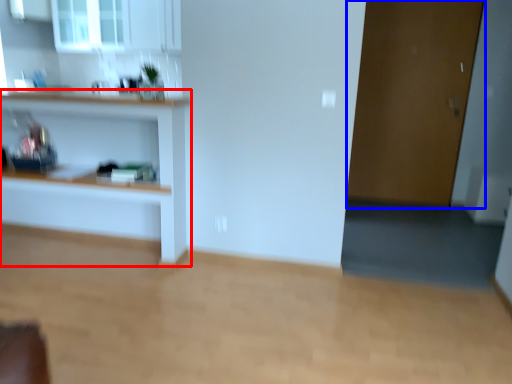
Question: Which object appears closest to the camera in this image, shelf (highlighted by a red box) or door (highlighted by a blue box)?

Choices:
 (A) shelf
 (B) door

Answer: (A)